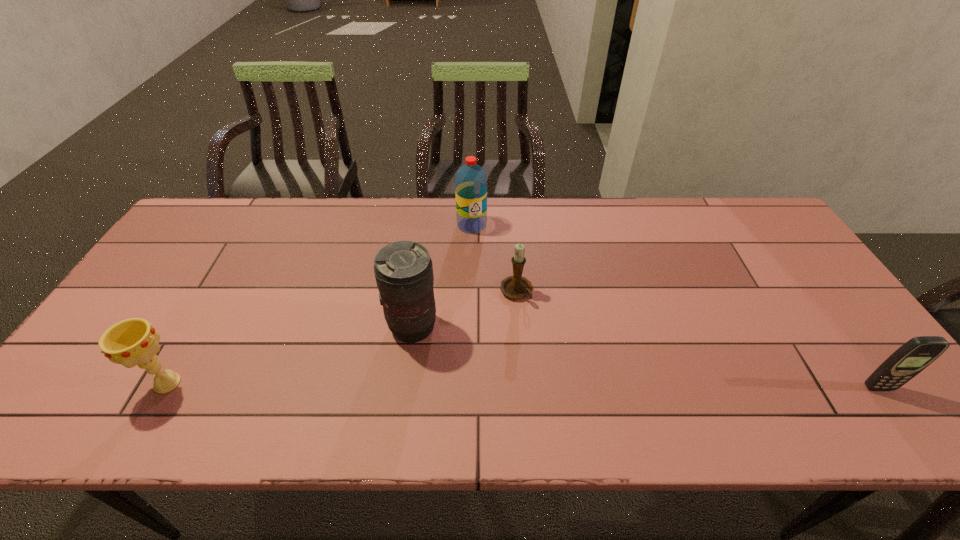
Locate an element on the screen. The image size is (960, 540). cellular telephone that is at the near edge is located at coordinates (915, 355).

This screenshot has width=960, height=540. In order to click on object present at the right edge in this screenshot , I will do `click(915, 355)`.

This screenshot has width=960, height=540. Identify the location of object located at the near right corner. (915, 355).

Find the location of a particular element. The image size is (960, 540). vacant space at the far edge is located at coordinates (432, 205).

The image size is (960, 540). I want to click on vacant space at the near edge of the desktop, so click(x=787, y=381).

This screenshot has height=540, width=960. In order to click on vacant point at the left edge in this screenshot , I will do `click(142, 305)`.

Locate an element on the screen. Image resolution: width=960 pixels, height=540 pixels. free space at the right edge of the desktop is located at coordinates (843, 335).

The image size is (960, 540). What are the coordinates of `vacant space at the far left corner of the desktop` in the screenshot? It's located at (185, 236).

Identify the location of vacant space that is in between the third object from left to right and the leftmost object. (320, 304).

The width and height of the screenshot is (960, 540). Identify the location of vacant region between the rightmost object and the third object from right to left. (675, 306).